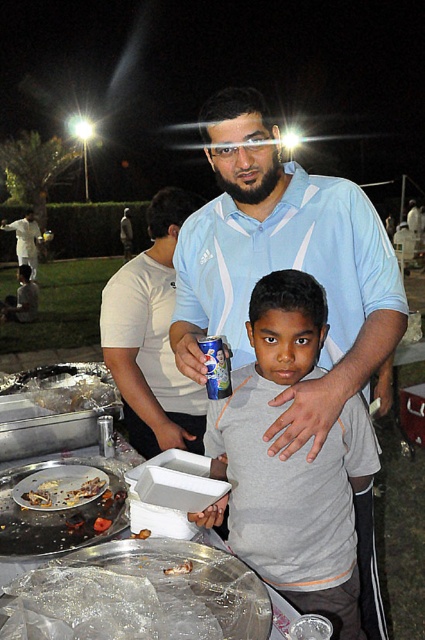
You are a photographer at the event and want to capture a photo of the matte white shirt at center. Where should you position your camera to ensure the shirt is in the frame?

The matte white shirt at center is located at point [152,337], so position the camera so that the center of the frame aligns with those coordinates to capture the shirt clearly.

You are organizing a picnic and have brought both the brown crispy chicken at lower left and the matte black laptop at left. If you want to place them side by side on a narrow table, which item should you place first to ensure they both fit?

The brown crispy chicken at lower left has a lesser width compared to the matte black laptop at left, so you should place the matte black laptop at left first to accommodate its larger size, then the brown crispy chicken at lower left would fit next to it.

You are a photographer at the event and want to capture a photo where both the gray matte shirt at center and the matte white shirt at center are visible. Based on their positions, which one should be placed in the foreground to ensure both are in frame?

The gray matte shirt at center should be placed in the foreground because it is positioned under the matte white shirt at center, meaning it is closer to the camera. This way, both shirts will be visible in the photo.